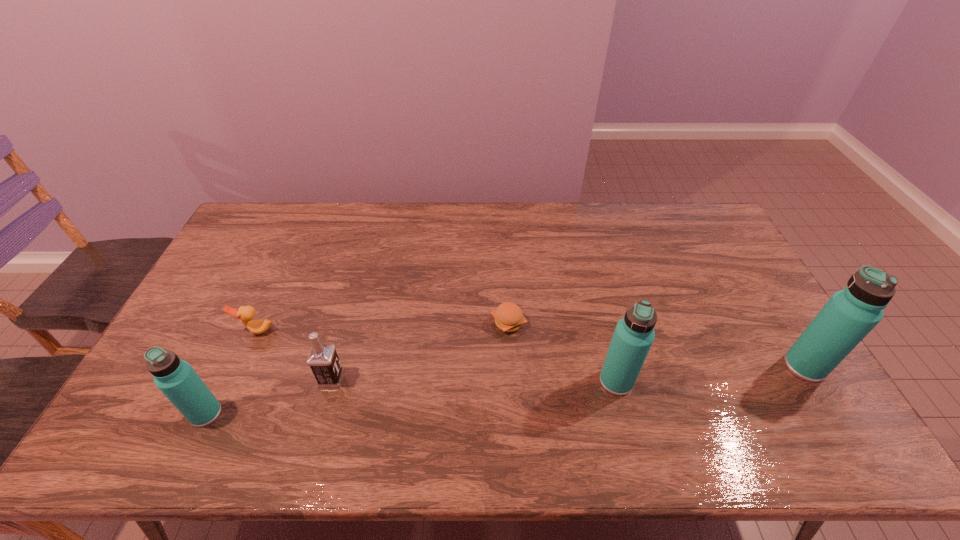
Identify the location of the nearest thermos bottle. Image resolution: width=960 pixels, height=540 pixels. (176, 379).

Image resolution: width=960 pixels, height=540 pixels. I want to click on the nearest object, so click(176, 379).

Where is `the second tallest thermos bottle`? Image resolution: width=960 pixels, height=540 pixels. the second tallest thermos bottle is located at coordinates (634, 334).

In order to click on the second tallest object in this screenshot , I will do `click(634, 334)`.

Locate an element on the screen. This screenshot has height=540, width=960. the rightmost object is located at coordinates (849, 315).

What are the coordinates of `the fourth object from right to left` in the screenshot? It's located at (323, 360).

Identify the location of the fourth tallest object. The image size is (960, 540). (323, 360).

You are a GUI agent. You are given a task and a screenshot of the screen. Output one action in this format:
    pyautogui.click(x=<x>, y=<y>)
    Task: Click on the third object from right to left
    This screenshot has height=540, width=960.
    Given the screenshot: What is the action you would take?
    pyautogui.click(x=508, y=316)

At what (x,y) coordinates should I click in order to perform the action: click on the shortest object. Please return your answer as a coordinate pair (x, y). Image resolution: width=960 pixels, height=540 pixels. Looking at the image, I should click on (508, 316).

This screenshot has height=540, width=960. I want to click on the second shortest object, so click(x=246, y=314).